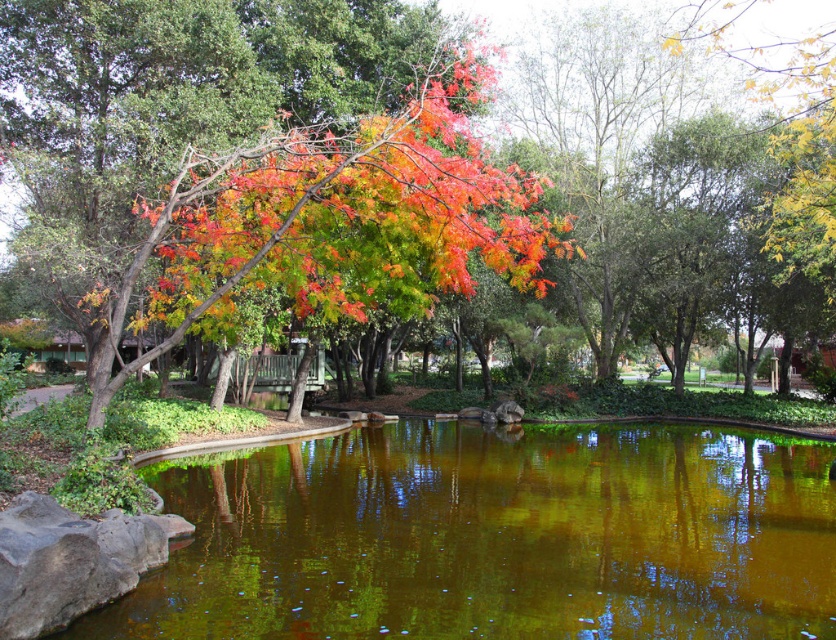
Image resolution: width=836 pixels, height=640 pixels. What do you see at coordinates (493, 536) in the screenshot?
I see `green reflective water at center` at bounding box center [493, 536].

What do you see at coordinates (493, 536) in the screenshot? I see `green reflective water at center` at bounding box center [493, 536].

The width and height of the screenshot is (836, 640). Identify the location of green reflective water at center. (493, 536).